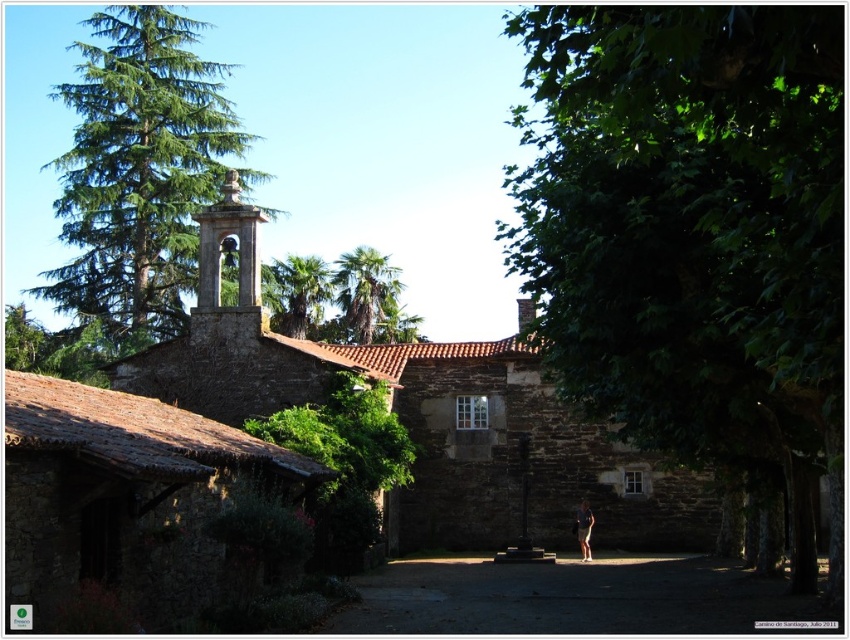
Question: Which object appears farthest from the camera in this image?

Choices:
 (A) brown leather shorts at center
 (B) green leafy palm at center
 (C) green leafy tree at center right

Answer: (B)

Question: Estimate the real-world distances between objects in this image. Which object is farther from the green leafy palm tree at upper center?

Choices:
 (A) brown leather shorts at center
 (B) smooth stone bell tower at upper center

Answer: (A)

Question: Can you confirm if smooth stone bell tower at upper center is positioned below brown leather shorts at center?

Choices:
 (A) no
 (B) yes

Answer: (A)

Question: Among these objects, which one is farthest from the camera?

Choices:
 (A) green leafy palm tree at upper center
 (B) green coniferous tree at upper left
 (C) green leafy palm at center
 (D) brown leather shorts at center

Answer: (A)

Question: Does smooth stone bell tower at upper center have a larger size compared to green leafy palm at center?

Choices:
 (A) yes
 (B) no

Answer: (B)

Question: Where is green leafy tree at center right located in relation to smooth stone bell tower at upper center in the image?

Choices:
 (A) left
 (B) right

Answer: (B)